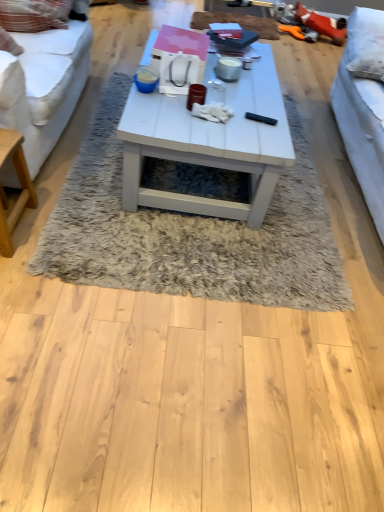
What do you see at coordinates (21, 185) in the screenshot? I see `light brown wooden table at left` at bounding box center [21, 185].

The width and height of the screenshot is (384, 512). What do you see at coordinates (191, 232) in the screenshot?
I see `white shaggy rug at center` at bounding box center [191, 232].

At what (x,y) coordinates should I click in order to perform the action: click on light brown wooden table at left. Please return your answer as a coordinate pair (x, y). This screenshot has height=512, width=384. Looking at the image, I should click on (21, 185).

From a real-world perspective, which is physically above, white matte coffee table at center or white fabric studio couch at left, which is the first studio couch from left to right?

white fabric studio couch at left, which is the first studio couch from left to right, is physically above.

Can you confirm if white matte coffee table at center is taller than white fabric studio couch at left, arranged as the 2th studio couch when viewed from the right?

No, white matte coffee table at center is not taller than white fabric studio couch at left, arranged as the 2th studio couch when viewed from the right.

Is white matte coffee table at center looking in the opposite direction of white fabric studio couch at left, arranged as the 2th studio couch when viewed from the right?

white matte coffee table at center is not turned away from white fabric studio couch at left, arranged as the 2th studio couch when viewed from the right.

From the image's perspective, is white fabric couch at right, positioned as the first studio couch in right-to-left order, over white fabric studio couch at left, arranged as the 2th studio couch when viewed from the right?

Actually, white fabric couch at right, positioned as the first studio couch in right-to-left order, appears below white fabric studio couch at left, arranged as the 2th studio couch when viewed from the right, in the image.

Considering the sizes of objects white fabric couch at right, positioned as the second studio couch in left-to-right order, and white fabric studio couch at left, which is the first studio couch from left to right, in the image provided, who is bigger, white fabric couch at right, positioned as the second studio couch in left-to-right order, or white fabric studio couch at left, which is the first studio couch from left to right,?

white fabric studio couch at left, which is the first studio couch from left to right, is bigger.

From a real-world perspective, does white fabric couch at right, positioned as the first studio couch in right-to-left order, sit lower than white fabric studio couch at left, arranged as the 2th studio couch when viewed from the right?

Yes, from a real-world perspective, white fabric couch at right, positioned as the first studio couch in right-to-left order, is beneath white fabric studio couch at left, arranged as the 2th studio couch when viewed from the right.

From the image's perspective, which is above, light brown wooden table at left or white fabric couch at right, positioned as the first studio couch in right-to-left order?

white fabric couch at right, positioned as the first studio couch in right-to-left order, from the image's perspective.

Which object is positioned more to the right, light brown wooden table at left or white fabric couch at right, positioned as the second studio couch in left-to-right order?

white fabric couch at right, positioned as the second studio couch in left-to-right order.

This screenshot has height=512, width=384. In order to click on the 1st studio couch positioned above the light brown wooden table at left (from a real-world perspective) in this screenshot , I will do 363,105.

Is light brown wooden table at left taller than white fabric couch at right, positioned as the second studio couch in left-to-right order?

No, light brown wooden table at left is not taller than white fabric couch at right, positioned as the second studio couch in left-to-right order.

How different are the orientations of white shaggy rug at center and light brown wooden table at left in degrees?

The angular difference between white shaggy rug at center and light brown wooden table at left is 89.7 degrees.

Relative to light brown wooden table at left, is white shaggy rug at center in front or behind?

Clearly, white shaggy rug at center is behind light brown wooden table at left.

Considering the sizes of objects white shaggy rug at center and light brown wooden table at left in the image provided, who is taller, white shaggy rug at center or light brown wooden table at left?

light brown wooden table at left.

From a real-world perspective, does white shaggy rug at center stand above light brown wooden table at left?

No.

Is white fabric studio couch at left, arranged as the 2th studio couch when viewed from the right, next to white matte coffee table at center?

No, white fabric studio couch at left, arranged as the 2th studio couch when viewed from the right, is not touching white matte coffee table at center.

Can you confirm if white fabric studio couch at left, which is the first studio couch from left to right, is positioned to the left of white matte coffee table at center?

Correct, you'll find white fabric studio couch at left, which is the first studio couch from left to right, to the left of white matte coffee table at center.

Is white fabric studio couch at left, which is the first studio couch from left to right, oriented away from white matte coffee table at center?

Result: No, white fabric studio couch at left, which is the first studio couch from left to right,'s orientation is not away from white matte coffee table at center.

Does point (57, 95) lie behind point (156, 200)?

Yes.

Between white fabric studio couch at left, arranged as the 2th studio couch when viewed from the right, and light brown wooden table at left, which one appears on the right side from the viewer's perspective?

From the viewer's perspective, light brown wooden table at left appears more on the right side.

Find the location of a particular element. The width and height of the screenshot is (384, 512). the 2nd studio couch positioned above the light brown wooden table at left (from the image's perspective) is located at coordinates (44, 86).

In the scene shown: Considering the sizes of objects white fabric studio couch at left, which is the first studio couch from left to right, and light brown wooden table at left in the image provided, who is smaller, white fabric studio couch at left, which is the first studio couch from left to right, or light brown wooden table at left?

light brown wooden table at left is smaller.

Looking at their sizes, would you say white fabric studio couch at left, which is the first studio couch from left to right, is wider or thinner than light brown wooden table at left?

Considering their sizes, white fabric studio couch at left, which is the first studio couch from left to right, looks broader than light brown wooden table at left.

Is white fabric studio couch at left, which is the first studio couch from left to right, not close to white shaggy rug at center?

white fabric studio couch at left, which is the first studio couch from left to right, is actually quite close to white shaggy rug at center.

Is white fabric studio couch at left, arranged as the 2th studio couch when viewed from the right, bigger than white shaggy rug at center?

Yes.

Identify the location of mat on the right of white fabric studio couch at left, arranged as the 2th studio couch when viewed from the right. The image size is (384, 512). (x=191, y=232).

At what (x,y) coordinates should I click in order to perform the action: click on studio couch located above the white matte coffee table at center (from the image's perspective). Please return your answer as a coordinate pair (x, y). The height and width of the screenshot is (512, 384). Looking at the image, I should click on (44, 86).

Find the location of a particular element. This screenshot has width=384, height=512. studio couch on the right side of white fabric studio couch at left, arranged as the 2th studio couch when viewed from the right is located at coordinates (363, 105).

Which object lies nearer to the anchor point white matte coffee table at center, light brown wooden table at left or white shaggy rug at center?

white shaggy rug at center is positioned closer to the anchor white matte coffee table at center.

Based on their spatial positions, is light brown wooden table at left or white matte coffee table at center further from white shaggy rug at center?

The object further to white shaggy rug at center is light brown wooden table at left.

Based on the photo, looking at the image, which one is located closer to light brown wooden table at left, white fabric studio couch at left, which is the first studio couch from left to right, or white shaggy rug at center?

Among the two, white fabric studio couch at left, which is the first studio couch from left to right, is located nearer to light brown wooden table at left.

In the scene shown: From the image, which object appears to be farther from white matte coffee table at center, light brown wooden table at left or white fabric studio couch at left, arranged as the 2th studio couch when viewed from the right?

light brown wooden table at left is further to white matte coffee table at center.

When comparing their distances from light brown wooden table at left, does white fabric studio couch at left, which is the first studio couch from left to right, or white matte coffee table at center seem further?

white matte coffee table at center.

From the image, which object appears to be farther from white fabric studio couch at left, which is the first studio couch from left to right, white shaggy rug at center or white matte coffee table at center?

white matte coffee table at center.

From the image, which object appears to be farther from light brown wooden table at left, white fabric couch at right, positioned as the second studio couch in left-to-right order, or white fabric studio couch at left, which is the first studio couch from left to right?

white fabric couch at right, positioned as the second studio couch in left-to-right order.

Consider the image. Looking at the image, which one is located further to white matte coffee table at center, white fabric couch at right, positioned as the first studio couch in right-to-left order, or light brown wooden table at left?

The object further to white matte coffee table at center is white fabric couch at right, positioned as the first studio couch in right-to-left order.

I want to click on table between white fabric studio couch at left, which is the first studio couch from left to right, and white fabric couch at right, positioned as the second studio couch in left-to-right order, so click(x=21, y=185).

Where is `coffee table between white fabric studio couch at left, which is the first studio couch from left to right, and white fabric couch at right, positioned as the first studio couch in right-to-left order, from left to right`? The width and height of the screenshot is (384, 512). coffee table between white fabric studio couch at left, which is the first studio couch from left to right, and white fabric couch at right, positioned as the first studio couch in right-to-left order, from left to right is located at coordinates (210, 143).

The height and width of the screenshot is (512, 384). I want to click on mat located between light brown wooden table at left and white fabric couch at right, positioned as the first studio couch in right-to-left order, in the left-right direction, so click(x=191, y=232).

Identify the location of table located between white fabric studio couch at left, arranged as the 2th studio couch when viewed from the right, and white matte coffee table at center in the left-right direction. The width and height of the screenshot is (384, 512). (21, 185).